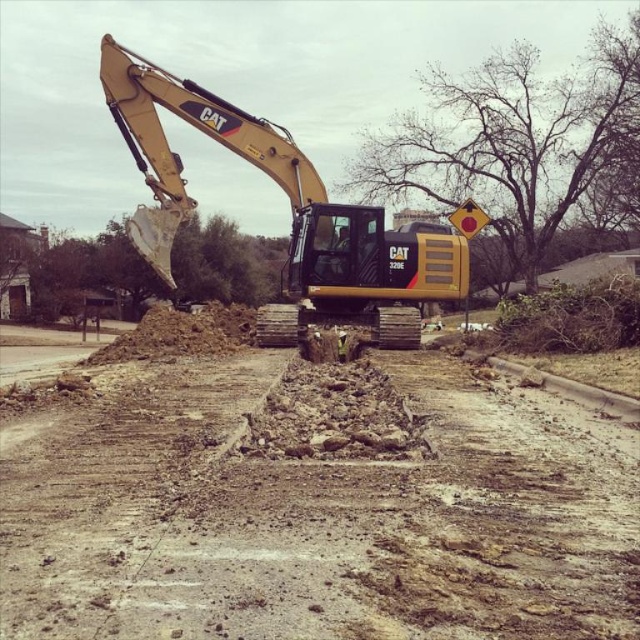
Question: Which object appears farthest from the camera in this image?

Choices:
 (A) yellow metallic excavator at center
 (B) brown gravel dirt track at center

Answer: (A)

Question: Can you confirm if brown gravel dirt track at center is smaller than yellow metallic excavator at center?

Choices:
 (A) no
 (B) yes

Answer: (B)

Question: Can you confirm if brown gravel dirt track at center is thinner than yellow metallic excavator at center?

Choices:
 (A) yes
 (B) no

Answer: (A)

Question: Can you confirm if brown gravel dirt track at center is positioned to the right of yellow metallic excavator at center?

Choices:
 (A) yes
 (B) no

Answer: (A)

Question: Among these points, which one is farthest from the camera?

Choices:
 (A) (214, 108)
 (B) (180, 429)

Answer: (A)